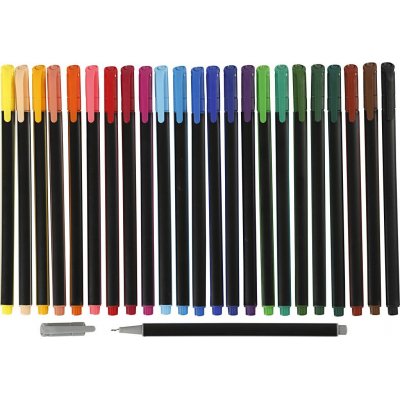
Locate an element on the screen. This screenshot has height=400, width=400. neutral tones is located at coordinates (65, 334), (386, 134), (376, 134), (359, 137).